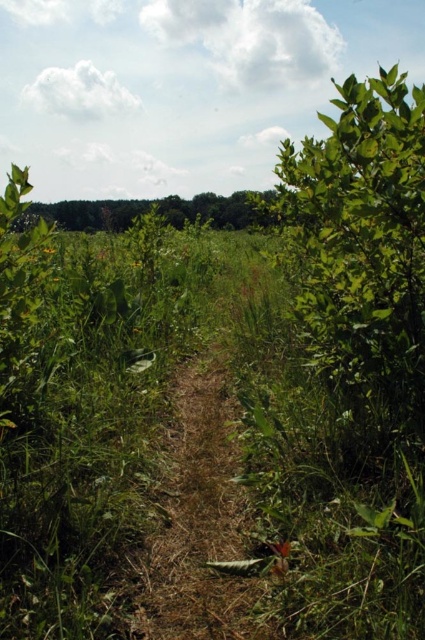
Measure the distance between brown grassy dirt track at center and green leafy tree at upper center.

The distance of brown grassy dirt track at center from green leafy tree at upper center is 41.02 feet.

Measure the distance between point (141, 604) and camera.

Point (141, 604) is 1.59 meters from camera.

Which is in front, point (187, 419) or point (184, 216)?

Point (187, 419) is more forward.

Locate an element on the screen. The image size is (425, 640). brown grassy dirt track at center is located at coordinates (197, 520).